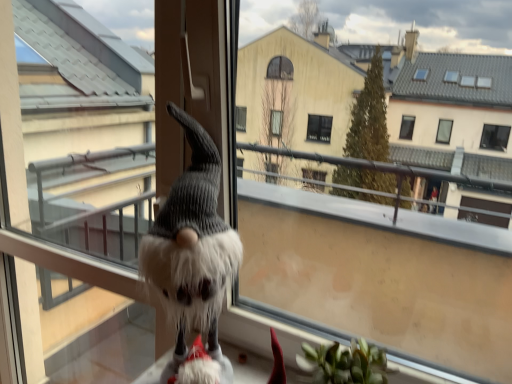
Question: Does fuzzy fabric gnome at lower left have a lesser height compared to fluffy white gnome at center?

Choices:
 (A) no
 (B) yes

Answer: (A)

Question: From the image's perspective, would you say fuzzy fabric gnome at lower left is shown under fluffy white gnome at center?

Choices:
 (A) yes
 (B) no

Answer: (B)

Question: Is fuzzy fabric gnome at lower left wider than fluffy white gnome at center?

Choices:
 (A) no
 (B) yes

Answer: (B)

Question: Can you confirm if fuzzy fabric gnome at lower left is thinner than fluffy white gnome at center?

Choices:
 (A) yes
 (B) no

Answer: (B)

Question: Does fuzzy fabric gnome at lower left have a larger size compared to fluffy white gnome at center?

Choices:
 (A) no
 (B) yes

Answer: (B)

Question: From their relative heights in the image, would you say fuzzy fabric gnome at lower left is taller or shorter than fluffy white gnome at center?

Choices:
 (A) short
 (B) tall

Answer: (B)

Question: Which is correct: fuzzy fabric gnome at lower left is inside fluffy white gnome at center, or outside of it?

Choices:
 (A) inside
 (B) outside

Answer: (B)

Question: Is fuzzy fabric gnome at lower left bigger or smaller than fluffy white gnome at center?

Choices:
 (A) small
 (B) big

Answer: (B)

Question: From a real-world perspective, is fuzzy fabric gnome at lower left above or below fluffy white gnome at center?

Choices:
 (A) above
 (B) below

Answer: (A)

Question: Considering the positions of fuzzy fabric gnome at lower left and fuzzy gray screen door at center in the image, is fuzzy fabric gnome at lower left taller or shorter than fuzzy gray screen door at center?

Choices:
 (A) short
 (B) tall

Answer: (A)

Question: Based on their positions, is fuzzy fabric gnome at lower left located to the left or right of fuzzy gray screen door at center?

Choices:
 (A) right
 (B) left

Answer: (A)

Question: Is fuzzy fabric gnome at lower left wider or thinner than fuzzy gray screen door at center?

Choices:
 (A) thin
 (B) wide

Answer: (B)

Question: From a real-world perspective, is fuzzy fabric gnome at lower left positioned above or below fuzzy gray screen door at center?

Choices:
 (A) above
 (B) below

Answer: (A)

Question: Looking at their shapes, would you say fuzzy gray screen door at center is wider or thinner than fluffy white gnome at center?

Choices:
 (A) wide
 (B) thin

Answer: (B)

Question: From their relative heights in the image, would you say fuzzy gray screen door at center is taller or shorter than fluffy white gnome at center?

Choices:
 (A) short
 (B) tall

Answer: (B)